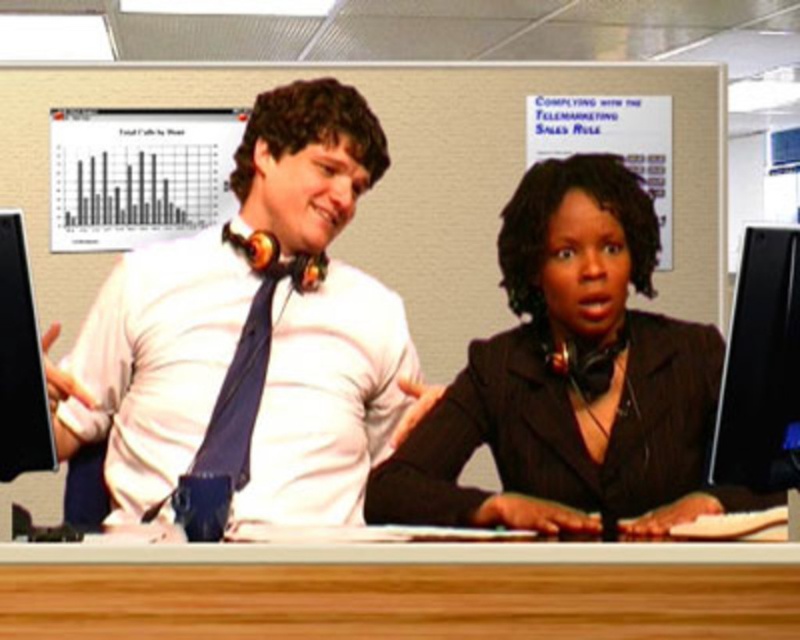
Can you confirm if wooden desk at lower center is taller than black plastic monitor at left?

Incorrect, wooden desk at lower center's height is not larger of black plastic monitor at left's.

Can you confirm if wooden desk at lower center is wider than black plastic monitor at left?

Indeed, wooden desk at lower center has a greater width compared to black plastic monitor at left.

Find the location of a particular element. wooden desk at lower center is located at coordinates (402, 589).

Is black glossy monitor at right wider than black plastic monitor at left?

No, black glossy monitor at right is not wider than black plastic monitor at left.

Which is in front, point (758, 307) or point (0, 268)?

Point (0, 268) is in front.

You are a GUI agent. You are given a task and a screenshot of the screen. Output one action in this format:
    pyautogui.click(x=<x>, y=<y>)
    Task: Click on the black glossy monitor at right
    This screenshot has width=800, height=640.
    Given the screenshot: What is the action you would take?
    pyautogui.click(x=762, y=368)

Is black matte suit at center positioned in front of matte blue tie at center?

No, it is not.

Which is more to the left, black matte suit at center or matte blue tie at center?

Positioned to the left is matte blue tie at center.

The width and height of the screenshot is (800, 640). Describe the element at coordinates (572, 380) in the screenshot. I see `black matte suit at center` at that location.

Where is `black matte suit at center`? black matte suit at center is located at coordinates tap(572, 380).